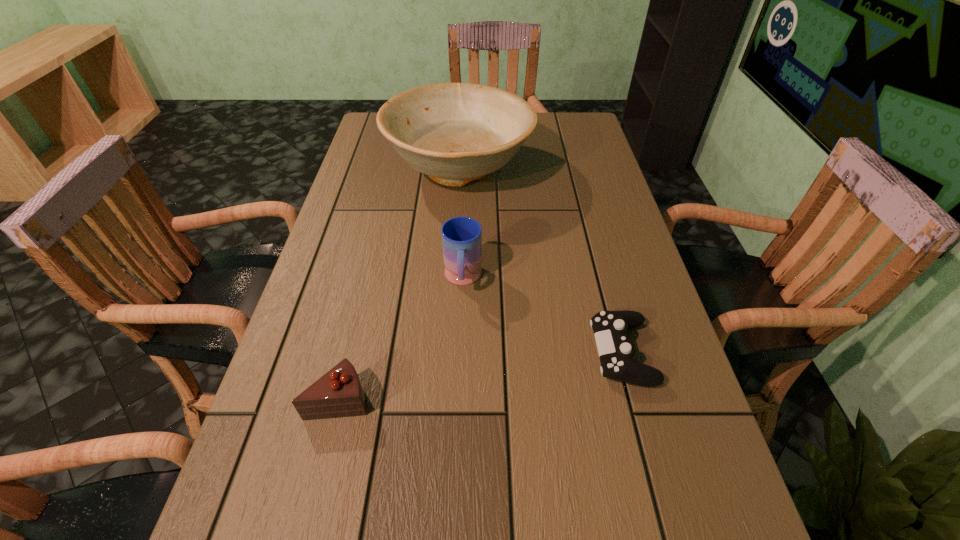
In order to click on free space between the farthest object and the third shortest object in this screenshot , I will do `click(399, 284)`.

Where is `the third closest object to the tallest object`? the third closest object to the tallest object is located at coordinates (338, 393).

The width and height of the screenshot is (960, 540). I want to click on object that is the fourth nearest to the dish, so click(x=474, y=539).

You are a GUI agent. You are given a task and a screenshot of the screen. Output one action in this format:
    pyautogui.click(x=<x>, y=<y>)
    Task: Click on the free space that satisfies the following two spatial constraints: 1. on the surface of the fourth tallest object; 2. on the front side of the left chocolate cake
    This screenshot has width=960, height=540.
    Given the screenshot: What is the action you would take?
    pyautogui.click(x=634, y=398)